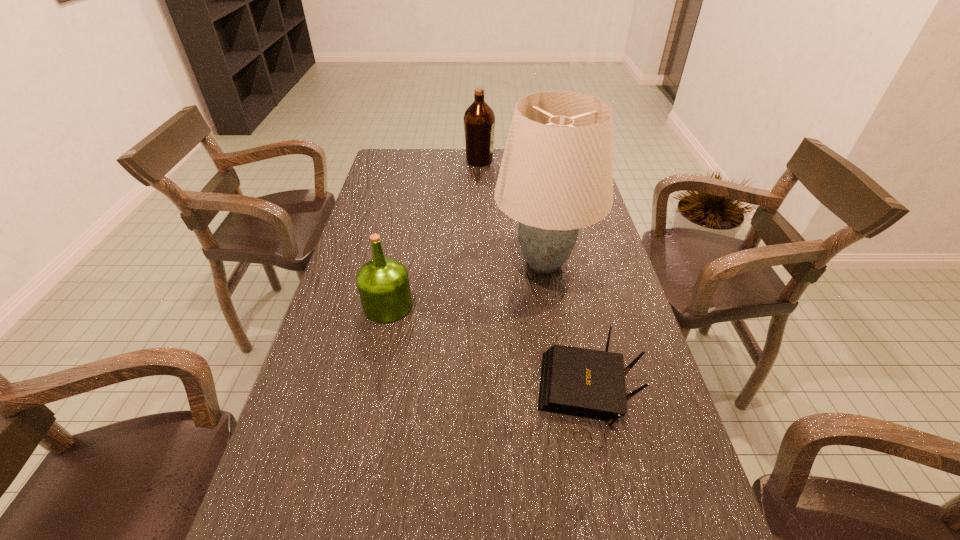
Where is `blank area in the image that satisfies the following two spatial constraints: 1. on the label of the tallest object; 2. on the right side of the farther olive oil`? This screenshot has height=540, width=960. blank area in the image that satisfies the following two spatial constraints: 1. on the label of the tallest object; 2. on the right side of the farther olive oil is located at coordinates (479, 262).

Locate an element on the screen. Image resolution: width=960 pixels, height=540 pixels. vacant space that satisfies the following two spatial constraints: 1. on the back side of the tallest object; 2. on the label of the right olive oil is located at coordinates (527, 161).